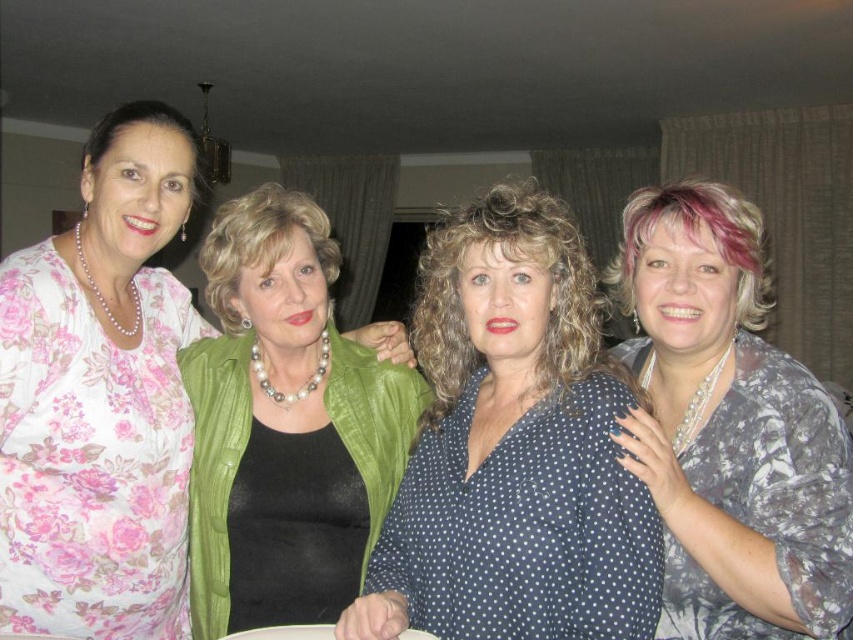
Based on the scene description, which object is positioned to the left of the other between the floral fabric blouse at left and the pearl necklace at center?

The floral fabric blouse at left is positioned to the left of the pearl necklace at center.

You are a photographer adjusting the lighting in the scene. You need to ensure that the polka dot blouse at center and the pearl necklace at center are both clearly visible. Which object should you focus on first to avoid obscuring details?

The polka dot blouse at center is positioned over pearl necklace at center, so you should focus on the pearl necklace at center first to ensure its details are not hidden by the blouse.

In the scene described, which object is positioned to the right of the other between the polka dot blouse at center and the pearl necklace at center?

The polka dot blouse at center is to the right of the pearl necklace at center.